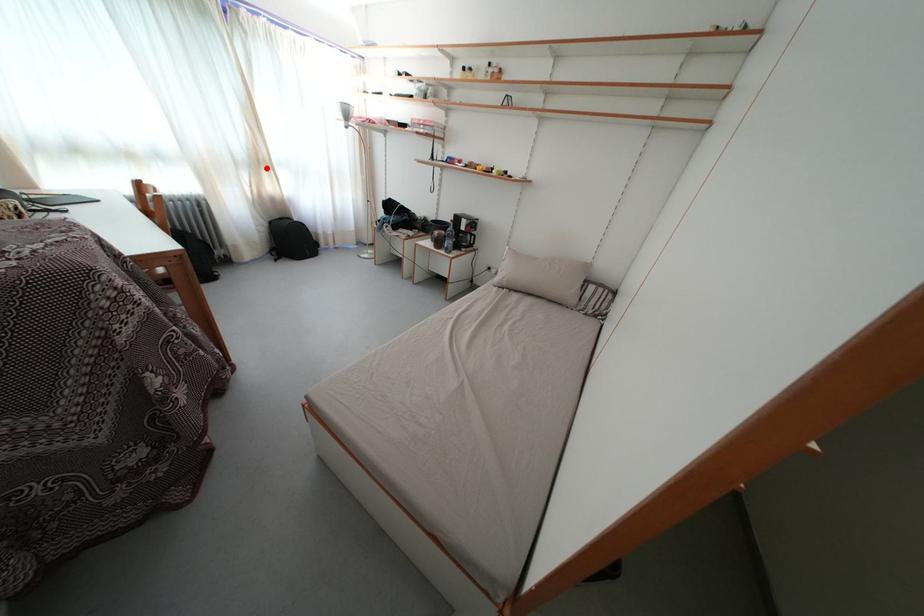
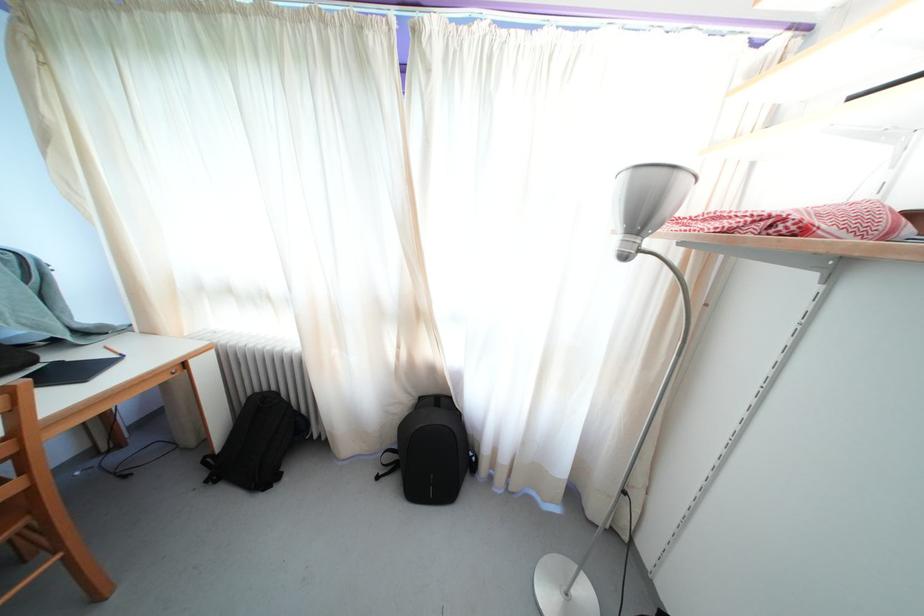
The point at the highlighted location is marked in the first image. Where is the corresponding point in the second image?

(421, 321)